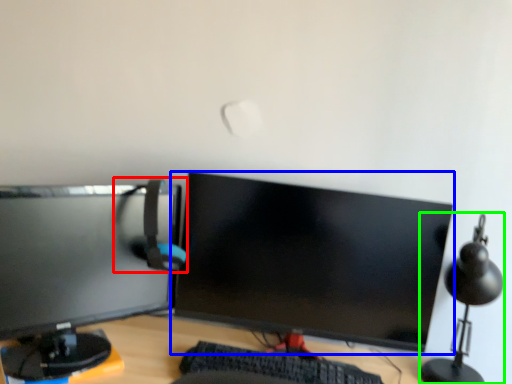
Question: Considering the real-world distances, which object is closest to computer chair (highlighted by a red box)? computer monitor (highlighted by a blue box) or table lamp (highlighted by a green box).

Choices:
 (A) computer monitor
 (B) table lamp

Answer: (A)